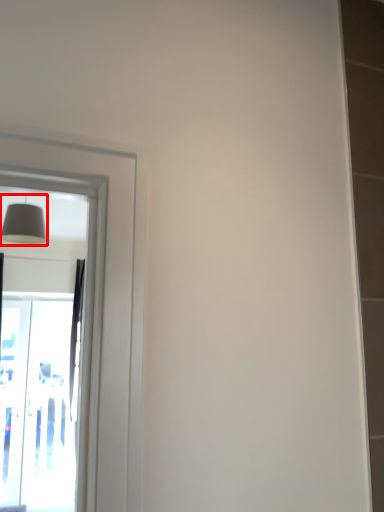
Question: From the image's perspective, what is the correct spatial positioning of lamp (annotated by the red box) in reference to screen door?

Choices:
 (A) above
 (B) below

Answer: (A)